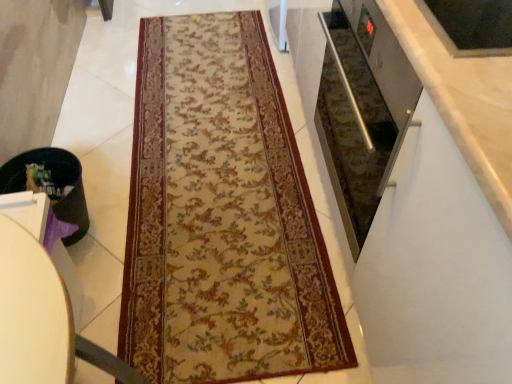
Question: Do you think black plastic trash can at lower left is within beige floral rug at center, or outside of it?

Choices:
 (A) inside
 (B) outside

Answer: (B)

Question: From a real-world perspective, relative to beige floral rug at center, is black plastic trash can at lower left vertically above or below?

Choices:
 (A) above
 (B) below

Answer: (A)

Question: Which object is the farthest from the black plastic trash can at lower left?

Choices:
 (A) black plastic trash can at lower left
 (B) beige floral rug at center

Answer: (B)

Question: Which object is positioned farthest from the beige floral rug at center?

Choices:
 (A) black plastic trash can at lower left
 (B) black plastic trash can at lower left

Answer: (A)